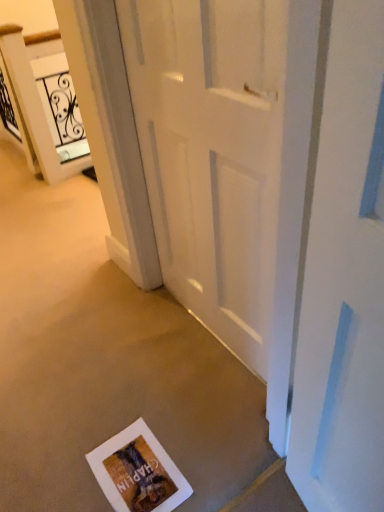
Question: Does white matte door at center have a larger size compared to white glossy elevator at upper left?

Choices:
 (A) yes
 (B) no

Answer: (B)

Question: Is white matte door at center taller than white glossy elevator at upper left?

Choices:
 (A) no
 (B) yes

Answer: (B)

Question: Is white matte door at center shorter than white glossy elevator at upper left?

Choices:
 (A) no
 (B) yes

Answer: (A)

Question: Would you say white matte door at center is outside white glossy elevator at upper left?

Choices:
 (A) no
 (B) yes

Answer: (B)

Question: Could white glossy elevator at upper left be considered to be inside white matte door at center?

Choices:
 (A) yes
 (B) no

Answer: (B)

Question: From a real-world perspective, is white matte door at center positioned under white glossy elevator at upper left based on gravity?

Choices:
 (A) yes
 (B) no

Answer: (B)

Question: From a real-world perspective, is white matte door at center positioned over matte paper postcard at lower center based on gravity?

Choices:
 (A) yes
 (B) no

Answer: (A)

Question: Is the depth of white matte door at center greater than that of matte paper postcard at lower center?

Choices:
 (A) yes
 (B) no

Answer: (B)

Question: From a real-world perspective, does white matte door at center sit lower than matte paper postcard at lower center?

Choices:
 (A) no
 (B) yes

Answer: (A)

Question: Is white matte door at center placed right next to matte paper postcard at lower center?

Choices:
 (A) no
 (B) yes

Answer: (A)

Question: Considering the relative sizes of white matte door at center and matte paper postcard at lower center in the image provided, is white matte door at center wider than matte paper postcard at lower center?

Choices:
 (A) yes
 (B) no

Answer: (B)

Question: Can you confirm if white matte door at center is smaller than matte paper postcard at lower center?

Choices:
 (A) yes
 (B) no

Answer: (B)

Question: Considering the relative sizes of white glossy elevator at upper left and white matte door at center in the image provided, is white glossy elevator at upper left thinner than white matte door at center?

Choices:
 (A) no
 (B) yes

Answer: (A)